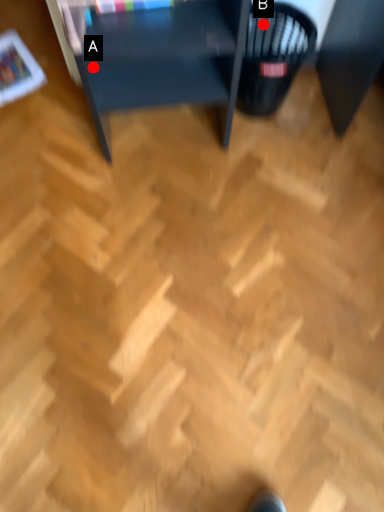
Question: Two points are circled on the image, labeled by A and B beside each circle. Among these points, which one is farthest from the camera?

Choices:
 (A) A is further
 (B) B is further

Answer: (B)